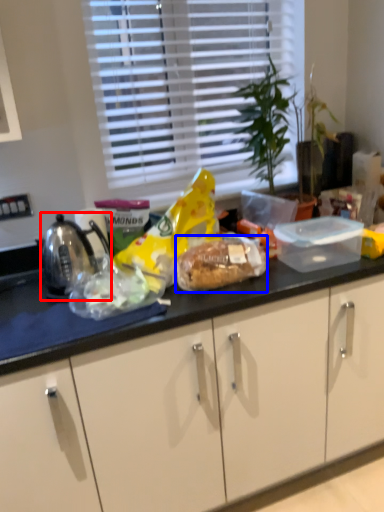
Question: Which object appears closest to the camera in this image, kettle (highlighted by a red box) or snack (highlighted by a blue box)?

Choices:
 (A) kettle
 (B) snack

Answer: (B)